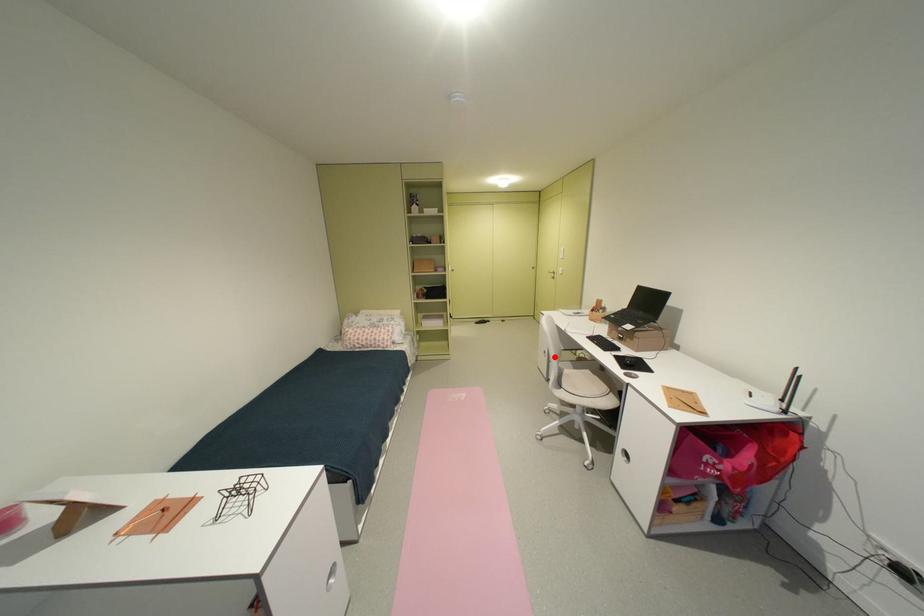
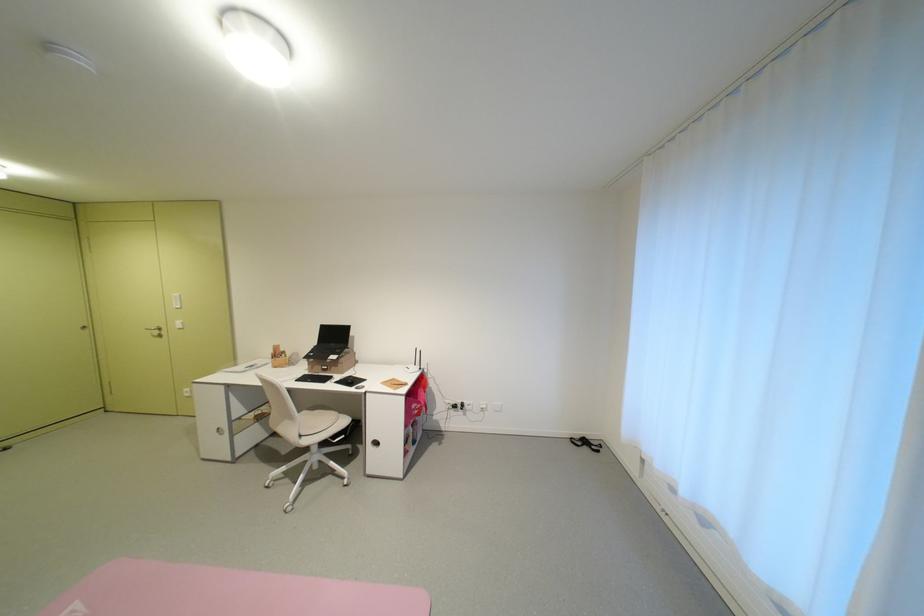
Question: I am providing you with two images of the same scene from different viewpoints. A red point is shown in image1. For the corresponding object point in image2, is it positioned nearer or farther from the camera?

Choices:
 (A) Nearer
 (B) Farther

Answer: (A)